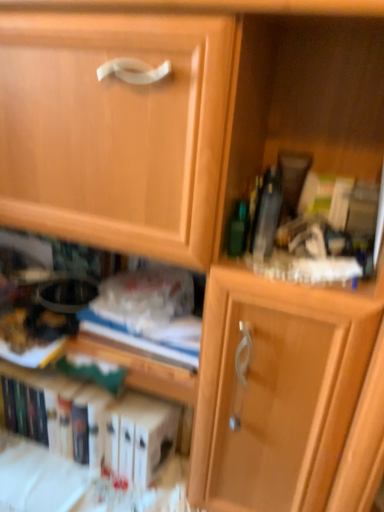
Describe the element at coordinates (106, 425) in the screenshot. The image size is (384, 512). I see `white matte book at lower left` at that location.

Measure the distance between point (161, 409) and camera.

A distance of 3.56 feet exists between point (161, 409) and camera.

Image resolution: width=384 pixels, height=512 pixels. In order to click on white matte book at lower left in this screenshot , I will do `click(106, 425)`.

The image size is (384, 512). Identify the location of white matte book at lower left. (106, 425).